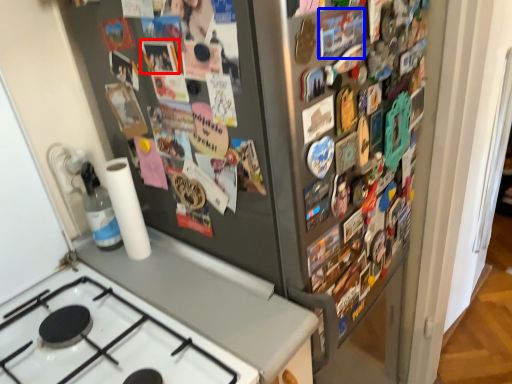
Question: Which of the following is the farthest to the observer, button (highlighted by a red box) or button (highlighted by a blue box)?

Choices:
 (A) button
 (B) button

Answer: (A)